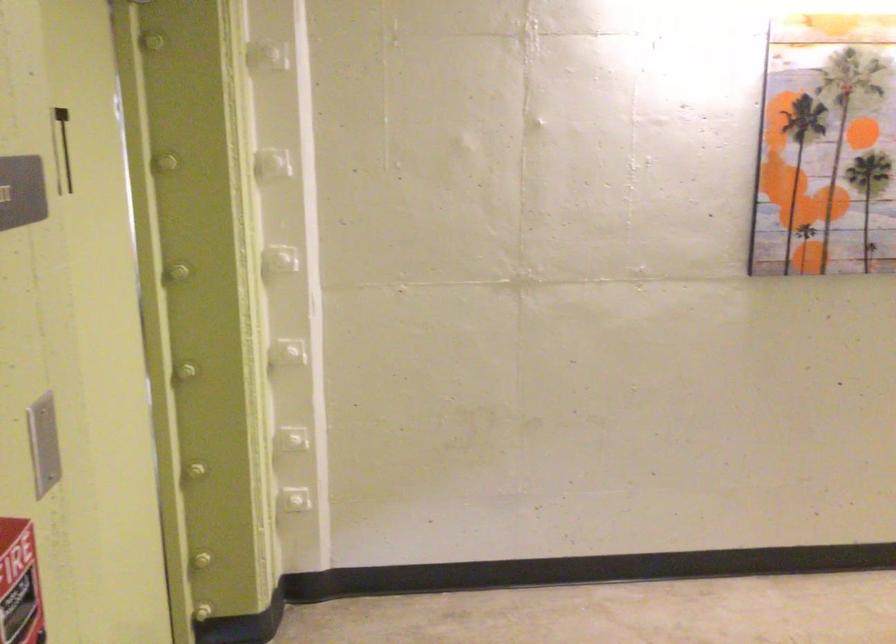
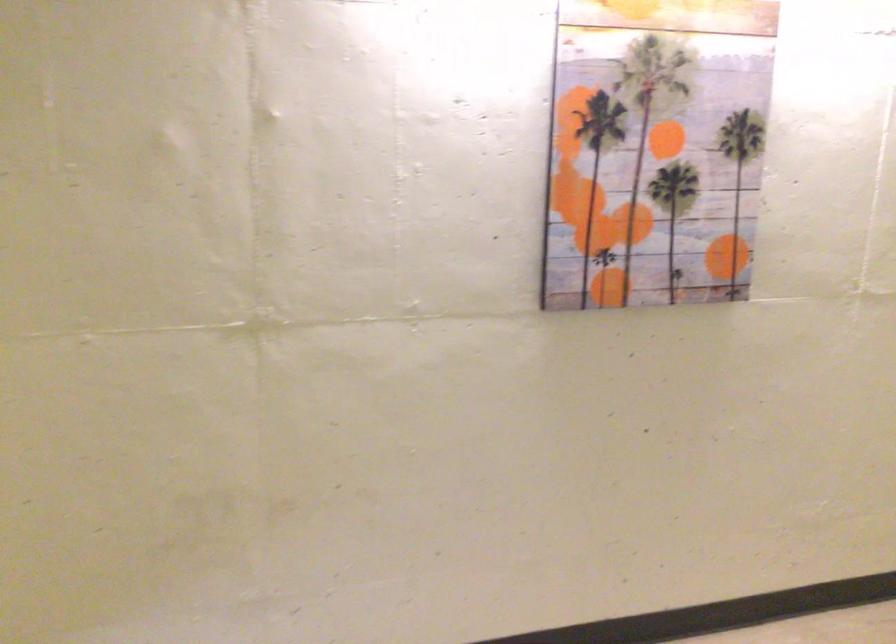
Question: The first image is from the beginning of the video and the second image is from the end. How did the camera likely rotate when shooting the video?

Choices:
 (A) Left
 (B) Right
 (C) Up
 (D) Down

Answer: (B)